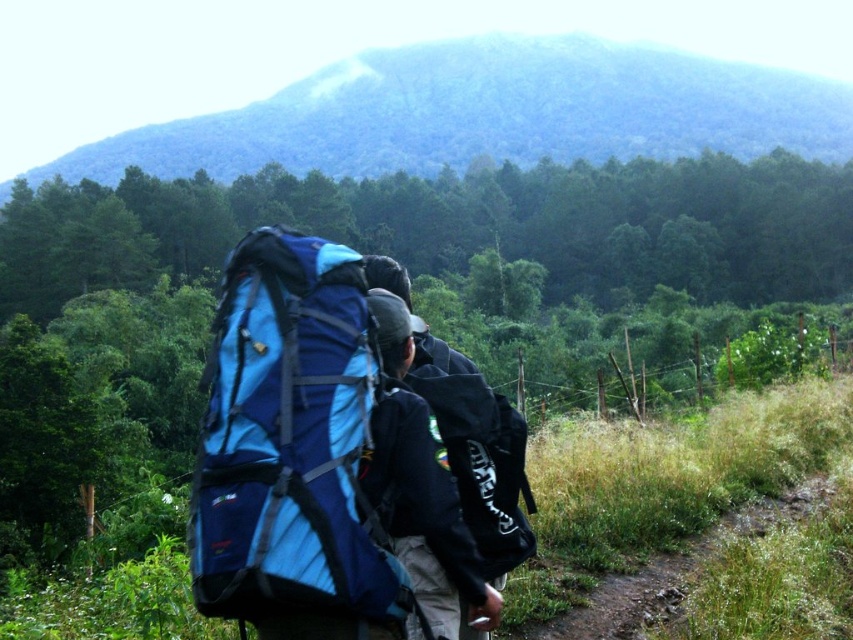
You are a hiker planning to carry both the blue fabric backpack at center and the black matte backpack at center on a narrow trail. Since the path is only wide enough for one backpack, which one should you choose to carry based on their sizes?

The blue fabric backpack at center is taller than the black matte backpack at center, so you should choose the black matte backpack at center because it is shorter and will fit better on the narrow path.

You are one of the hikers and you want to step onto the brown dirt path at lower right. Is the blue fabric backpack at center blocking your way?

The blue fabric backpack at center is in front of the brown dirt path at lower right, so it is blocking your way to the path.

You are a hiker planning to climb the green textured mountain at upper center. You see the black matte backpack at center that one of the hikers is carrying. Can you determine if the mountain is taller than the backpack?

The green textured mountain at upper center has a greater height compared to the black matte backpack at center, so yes, the mountain is taller than the backpack.